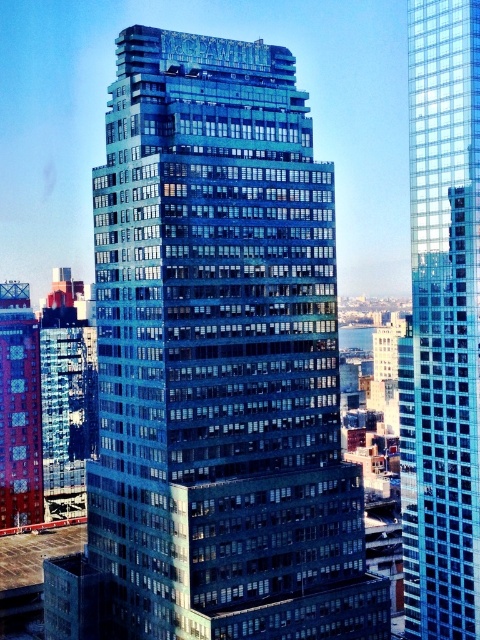
From the picture: You are standing at the center of the city square and want to take a photo of the shiny glass building at center. Based on its 2D coordinates, where should you position yourself to capture the building in the frame?

The shiny glass building at center is located at coordinates point (219, 356), so positioning yourself at the center of the city square should allow you to capture it in the frame as it is already centered in the scene.

You are a city planner evaluating the skyline. Based on the image, which building between the shiny glass building at center and the metallic red building at left is taller?

The shiny glass building at center is much taller than the metallic red building at left according to the description.

You are a city planner assessing the skyline. You need to determine which of the two buildings, the shiny glass building at center or the glassy reflective skyscraper at center, has a lower height for potential height restrictions. Which building should you prioritize?

The shiny glass building at center is shorter than the glassy reflective skyscraper at center, so you should prioritize the glassy reflective skyscraper at center for potential height restrictions since it is taller.